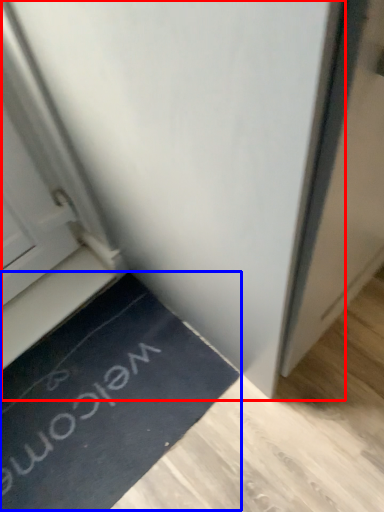
Question: Which of the following is the farthest to the observer, door (highlighted by a red box) or doormat (highlighted by a blue box)?

Choices:
 (A) door
 (B) doormat

Answer: (B)